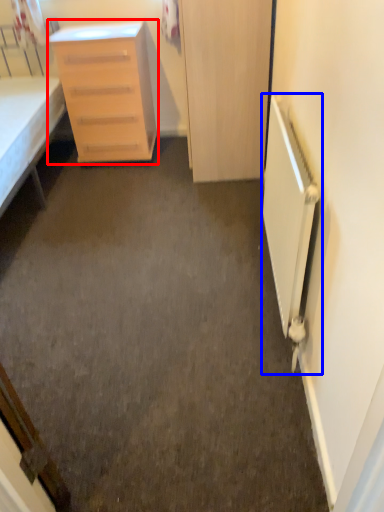
Question: Which of the following is the closest to the observer, chest of drawers (highlighted by a red box) or radiator (highlighted by a blue box)?

Choices:
 (A) chest of drawers
 (B) radiator

Answer: (B)